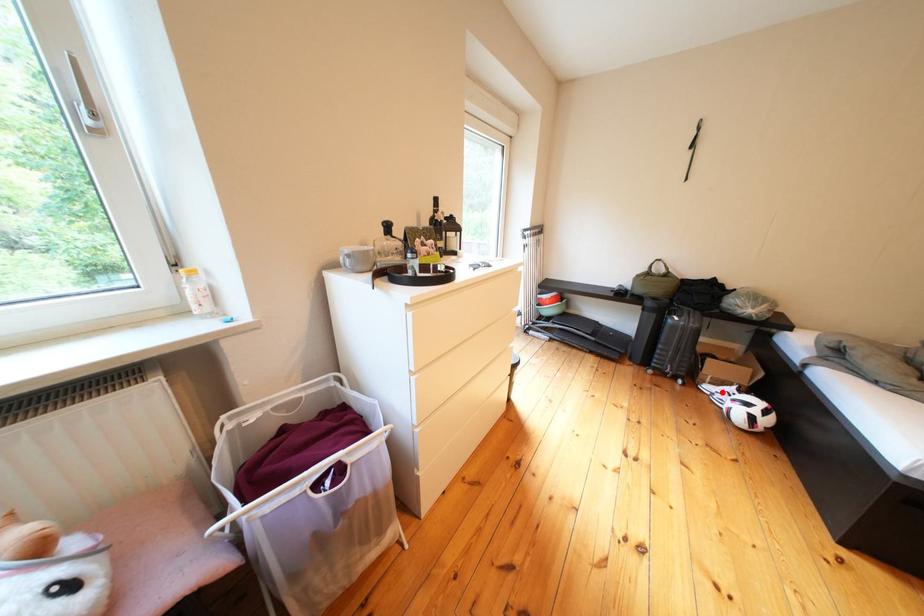
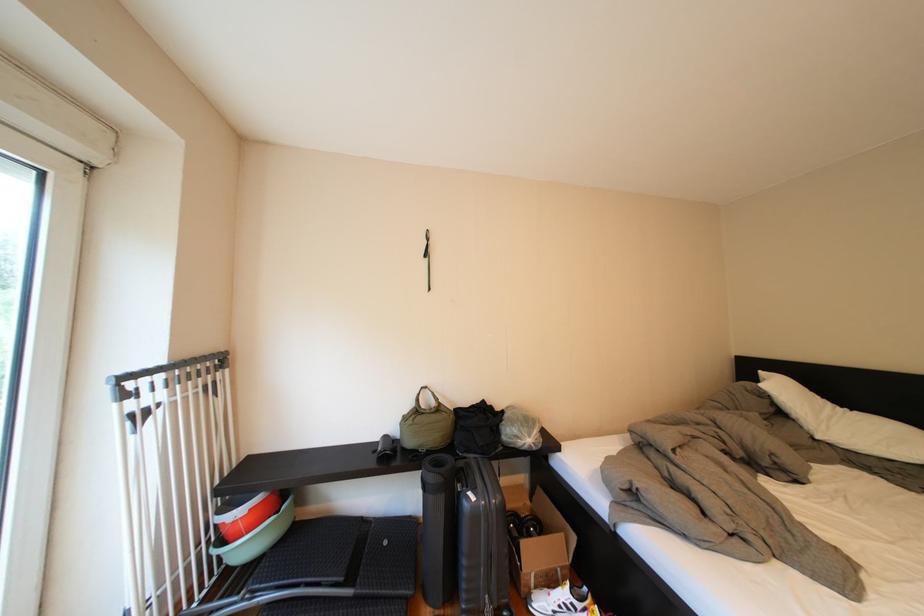
Locate, in the second image, the point that corresponds to the highlighted location in the first image.

(554, 609)